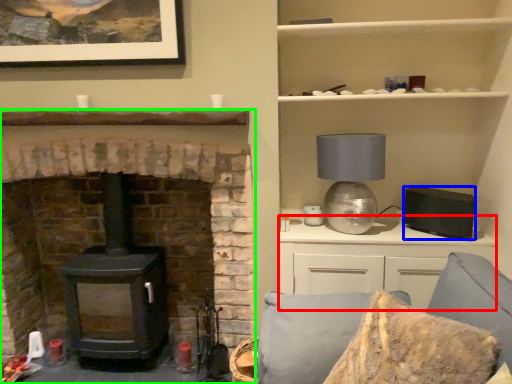
Question: Which object is the farthest from entertainment center (highlighted by a red box)? Choose among these: appliance (highlighted by a blue box) or fireplace (highlighted by a green box).

Choices:
 (A) appliance
 (B) fireplace

Answer: (B)